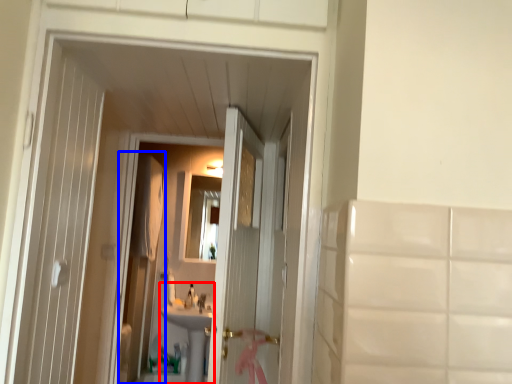
Question: Among these objects, which one is farthest to the camera, sink (highlighted by a red box) or screen door (highlighted by a blue box)?

Choices:
 (A) sink
 (B) screen door

Answer: (A)